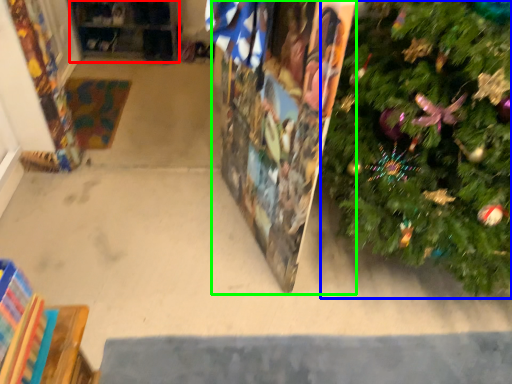
Question: Based on their relative distances, which object is farther from shelf (highlighted by a red box)? Choose from christmas tree (highlighted by a blue box) and bulletin board (highlighted by a green box).

Choices:
 (A) christmas tree
 (B) bulletin board

Answer: (A)